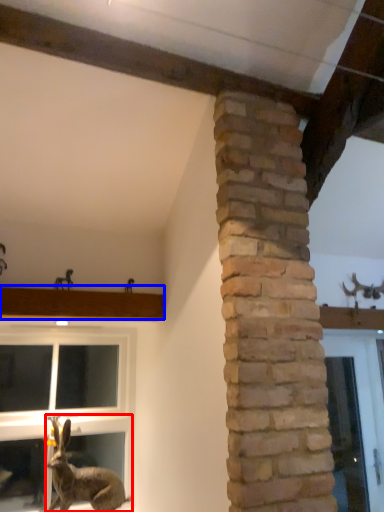
Question: Which point is closer to the camera, rabbit (highlighted by a red box) or window sill (highlighted by a blue box)?

Choices:
 (A) rabbit
 (B) window sill

Answer: (A)